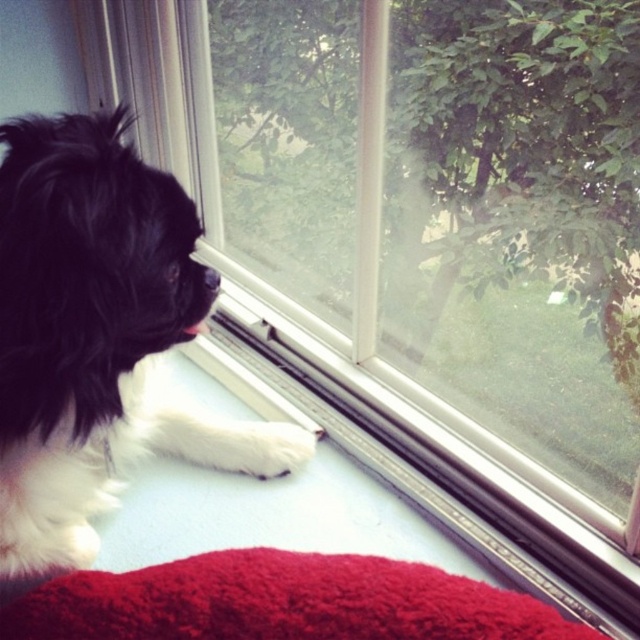
Question: Observing the image, what is the correct spatial positioning of black fluffy dog at left in reference to fluffy red blanket at lower center?

Choices:
 (A) above
 (B) below

Answer: (A)

Question: Is black fluffy dog at left smaller than fluffy red blanket at lower center?

Choices:
 (A) no
 (B) yes

Answer: (A)

Question: Among these points, which one is nearest to the camera?

Choices:
 (A) (452, 616)
 (B) (84, 460)

Answer: (A)

Question: Which object appears closest to the camera in this image?

Choices:
 (A) black fluffy dog at left
 (B) fluffy red blanket at lower center

Answer: (A)

Question: Considering the relative positions of black fluffy dog at left and fluffy red blanket at lower center in the image provided, where is black fluffy dog at left located with respect to fluffy red blanket at lower center?

Choices:
 (A) above
 (B) below

Answer: (A)

Question: Which point is farther to the camera?

Choices:
 (A) [x=141, y=595]
 (B) [x=52, y=456]

Answer: (B)